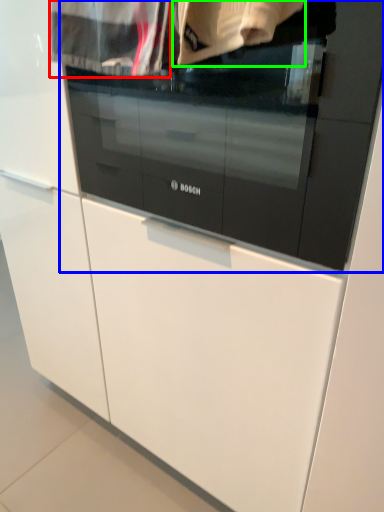
Question: Considering the real-world distances, which object is farthest from clothing (highlighted by a red box)? oven (highlighted by a blue box) or clothing (highlighted by a green box)?

Choices:
 (A) oven
 (B) clothing

Answer: (A)